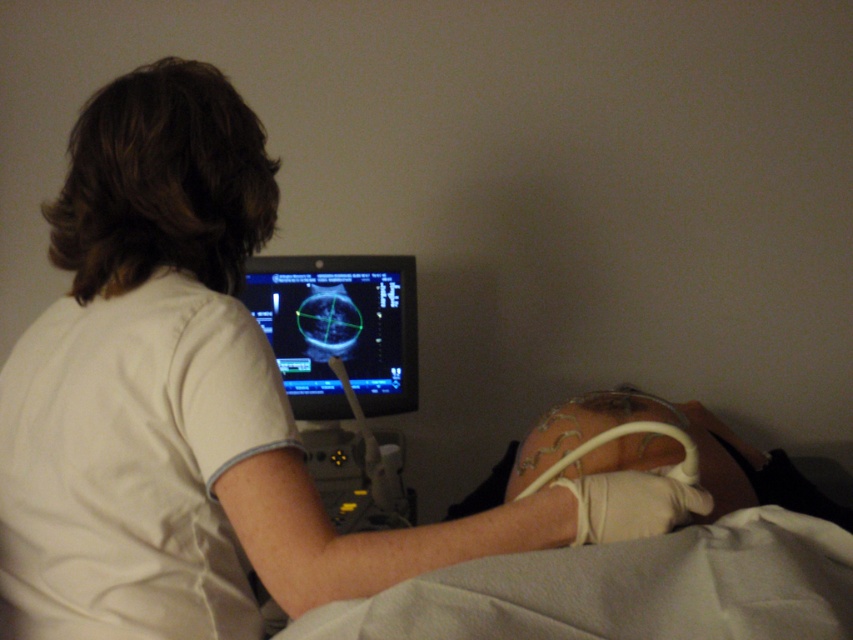
Question: Is white fabric bed at lower center positioned behind black glossy monitor at center?

Choices:
 (A) no
 (B) yes

Answer: (A)

Question: Which point is farther to the camera?

Choices:
 (A) black glossy monitor at center
 (B) white fabric bed at lower center

Answer: (A)

Question: Can you confirm if white fabric bed at lower center is positioned to the left of black glossy monitor at center?

Choices:
 (A) no
 (B) yes

Answer: (A)

Question: Is white fabric bed at lower center behind black glossy monitor at center?

Choices:
 (A) yes
 (B) no

Answer: (B)